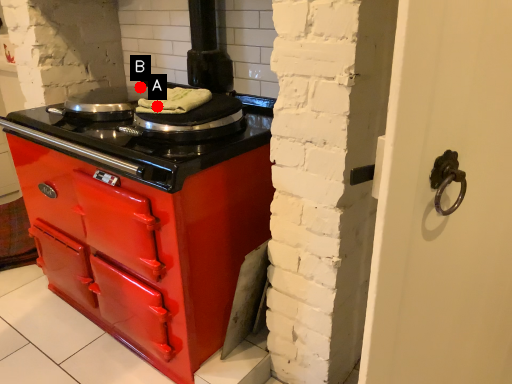
Question: Two points are circled on the image, labeled by A and B beside each circle. Which point is closer to the camera?

Choices:
 (A) A is closer
 (B) B is closer

Answer: (A)